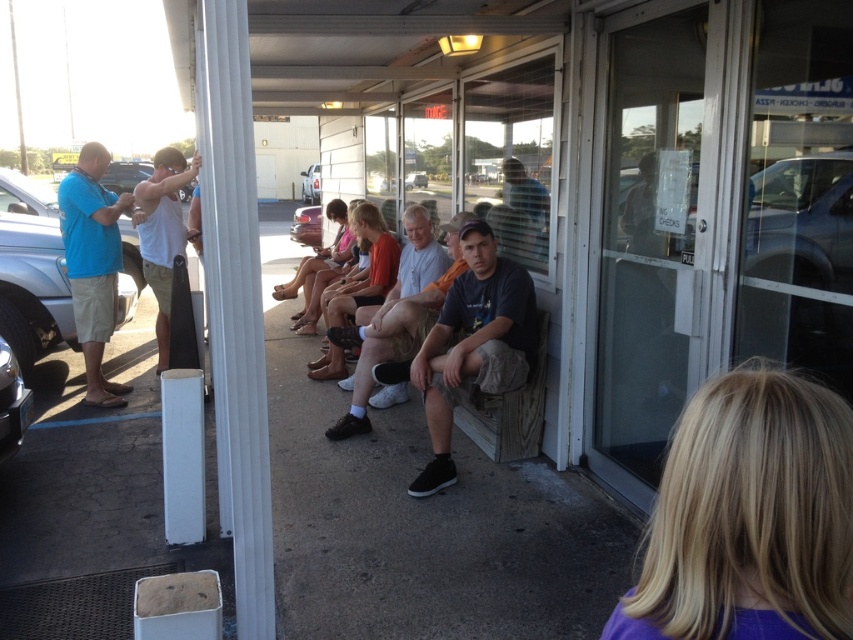
Is blonde hair at lower right to the left of shiny silver car at lower left from the viewer's perspective?

No, blonde hair at lower right is not to the left of shiny silver car at lower left.

Can you confirm if blonde hair at lower right is shorter than shiny silver car at lower left?

Yes.

Locate an element on the screen. This screenshot has width=853, height=640. blonde hair at lower right is located at coordinates (749, 516).

The height and width of the screenshot is (640, 853). Find the location of `blonde hair at lower right`. blonde hair at lower right is located at coordinates (749, 516).

Consider the image. Can you confirm if white matte tank top at left is positioned above silver metallic truck at center?

Incorrect, white matte tank top at left is not positioned above silver metallic truck at center.

Locate an element on the screen. Image resolution: width=853 pixels, height=640 pixels. white matte tank top at left is located at coordinates (161, 232).

Which is in front, point (160, 244) or point (305, 200)?

Point (160, 244) is more forward.

Locate an element on the screen. white matte tank top at left is located at coordinates (161, 232).

Is point (112, 317) less distant than point (331, 320)?

Yes, point (112, 317) is closer to viewer.

Is matte blue shirt at left to the left of orange cotton shirt at center from the viewer's perspective?

→ Yes, matte blue shirt at left is to the left of orange cotton shirt at center.

Identify the location of matte blue shirt at left. The width and height of the screenshot is (853, 640). (93, 264).